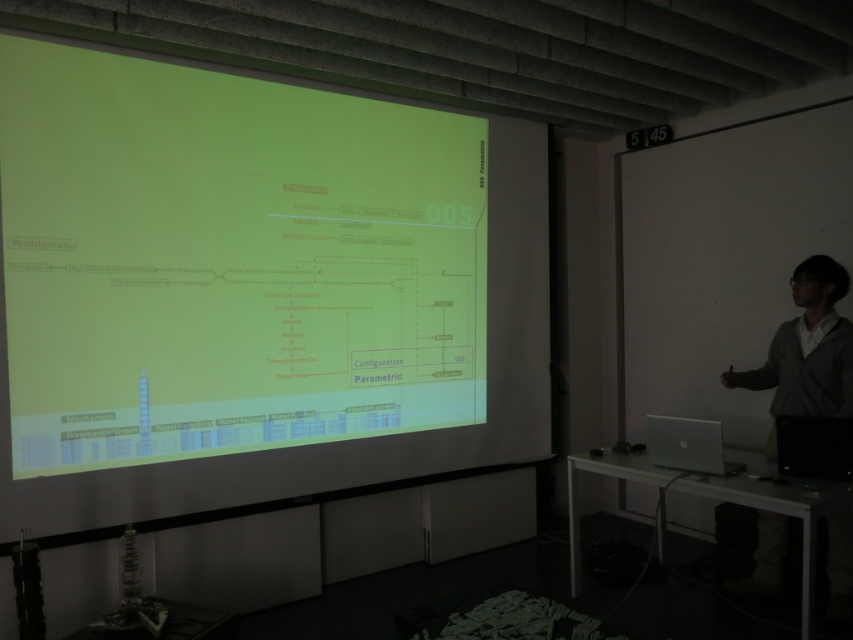
Who is lower down, black plastic computer at lower right or silver metallic laptop at lower right?

Positioned lower is silver metallic laptop at lower right.

Is black plastic computer at lower right wider than silver metallic laptop at lower right?

No, black plastic computer at lower right is not wider than silver metallic laptop at lower right.

Who is more forward, (833, 448) or (715, 465)?

Point (833, 448) is more forward.

This screenshot has height=640, width=853. I want to click on black plastic computer at lower right, so click(814, 445).

Can you confirm if matte yellow projector screen at center is shorter than black plastic computer at lower right?

In fact, matte yellow projector screen at center may be taller than black plastic computer at lower right.

Could you measure the distance between matte yellow projector screen at center and black plastic computer at lower right?

matte yellow projector screen at center and black plastic computer at lower right are 6.41 feet apart from each other.

Does point (221, 493) come behind point (846, 474)?

Yes, it is.

Where is `matte yellow projector screen at center`? The image size is (853, 640). matte yellow projector screen at center is located at coordinates (343, 376).

Can you confirm if matte yellow projector screen at center is positioned below silver metallic laptop at lower right?

No, matte yellow projector screen at center is not below silver metallic laptop at lower right.

Can you confirm if matte yellow projector screen at center is bigger than silver metallic laptop at lower right?

Correct, matte yellow projector screen at center is larger in size than silver metallic laptop at lower right.

Between point (546, 180) and point (679, 451), which one is positioned behind?

The point (546, 180) is more distant.

Locate an element on the screen. matte yellow projector screen at center is located at coordinates (343, 376).